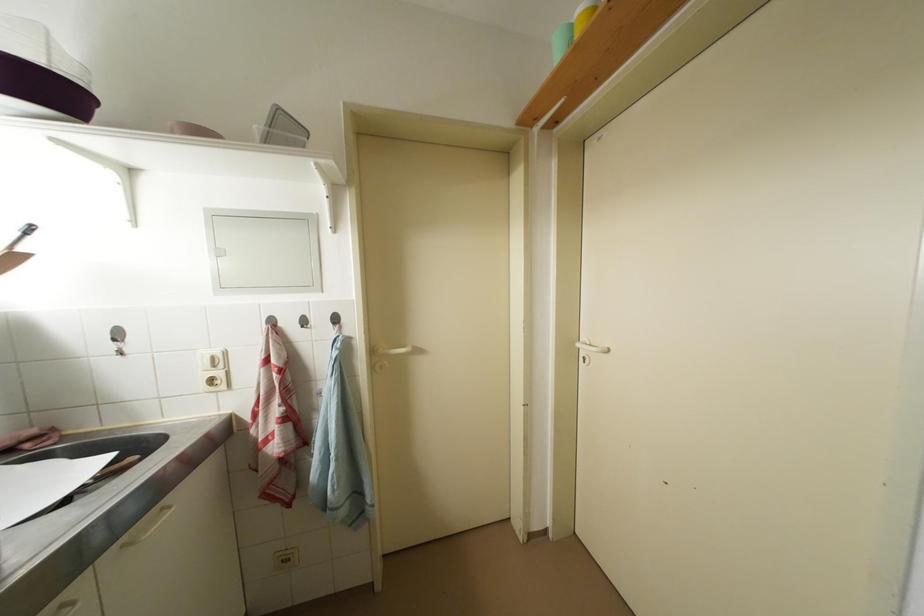
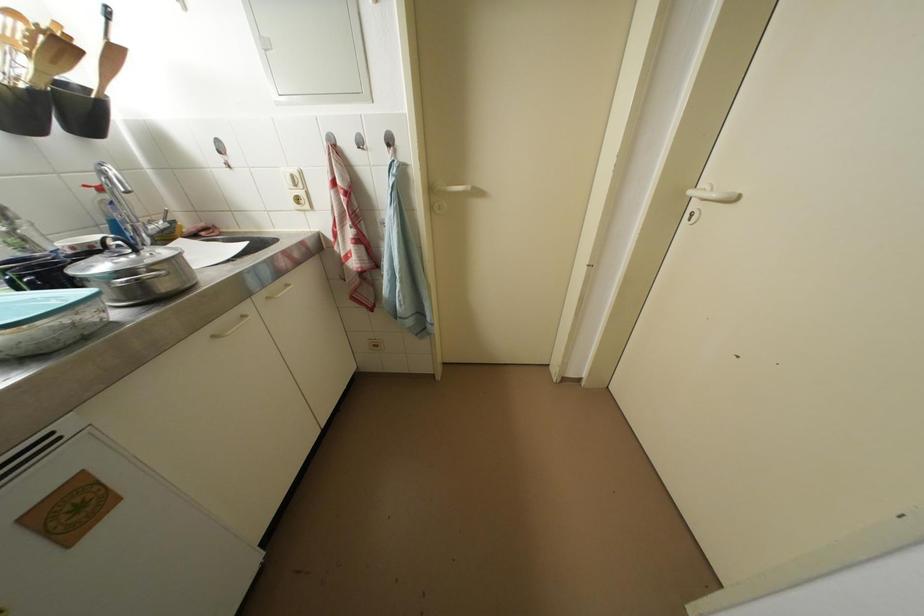
The point at (585, 349) is marked in the first image. Where is the corresponding point in the second image?

(698, 197)